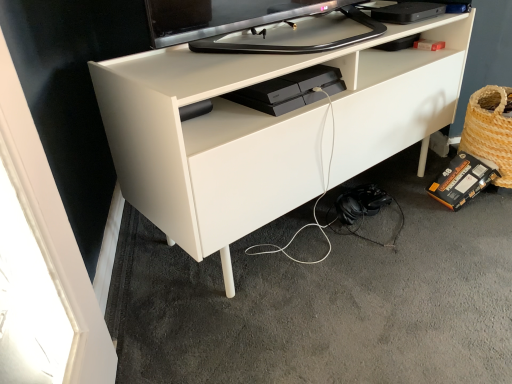
Question: From a real-world perspective, is white matte desk at center located beneath black matte headphones at lower right?

Choices:
 (A) no
 (B) yes

Answer: (A)

Question: Can we say white matte desk at center lies outside black matte headphones at lower right?

Choices:
 (A) yes
 (B) no

Answer: (A)

Question: Can you confirm if white matte desk at center is positioned to the left of black matte headphones at lower right?

Choices:
 (A) yes
 (B) no

Answer: (A)

Question: From the image's perspective, is white matte desk at center below black matte headphones at lower right?

Choices:
 (A) no
 (B) yes

Answer: (A)

Question: Is white matte desk at center further to camera compared to black matte headphones at lower right?

Choices:
 (A) no
 (B) yes

Answer: (A)

Question: Relative to black plastic gaming console at center, the second equipment viewed from the back, is white matte desk at center in front or behind?

Choices:
 (A) behind
 (B) front

Answer: (B)

Question: Is point (253, 185) closer or farther from the camera than point (272, 92)?

Choices:
 (A) closer
 (B) farther

Answer: (A)

Question: Do you think white matte desk at center is within black plastic gaming console at center, the second equipment viewed from the back, or outside of it?

Choices:
 (A) outside
 (B) inside

Answer: (A)

Question: Based on their sizes in the image, would you say white matte desk at center is bigger or smaller than black plastic gaming console at center, the 1th equipment when ordered from front to back?

Choices:
 (A) small
 (B) big

Answer: (B)

Question: Which is correct: woven straw basket at lower right is inside black matte headphones at lower right, or outside of it?

Choices:
 (A) outside
 (B) inside

Answer: (A)

Question: In terms of height, does woven straw basket at lower right look taller or shorter compared to black matte headphones at lower right?

Choices:
 (A) tall
 (B) short

Answer: (A)

Question: Would you say woven straw basket at lower right is to the left or to the right of black matte headphones at lower right in the picture?

Choices:
 (A) left
 (B) right

Answer: (B)

Question: From a real-world perspective, is woven straw basket at lower right above or below black matte headphones at lower right?

Choices:
 (A) above
 (B) below

Answer: (A)

Question: Is black matte headphones at lower right to the left or to the right of white matte desk at center in the image?

Choices:
 (A) right
 (B) left

Answer: (A)

Question: From the image's perspective, is black matte headphones at lower right located above or below white matte desk at center?

Choices:
 (A) below
 (B) above

Answer: (A)